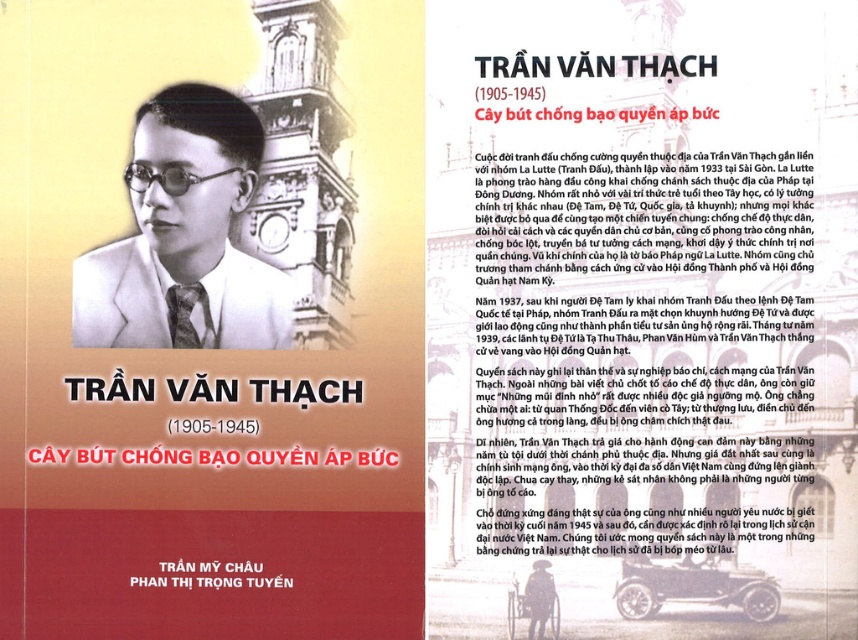
Who is lower down, white paper at upper center or matte black suit at center?

white paper at upper center is lower down.

Identify the location of white paper at upper center. (627, 332).

Is black paper at upper center positioned in front of matte black tie at center?

No, it is behind matte black tie at center.

Does point (154, 564) come farther from viewer compared to point (168, 307)?

Yes, point (154, 564) is behind point (168, 307).

Does point (286, 577) come farther from viewer compared to point (166, 294)?

No, (286, 577) is closer to viewer.

Find the location of a particular element. black paper at upper center is located at coordinates (210, 573).

What are the coordinates of `white paper at upper center` in the screenshot? It's located at (627, 332).

Identify the location of white paper at upper center. Image resolution: width=858 pixels, height=640 pixels. (627, 332).